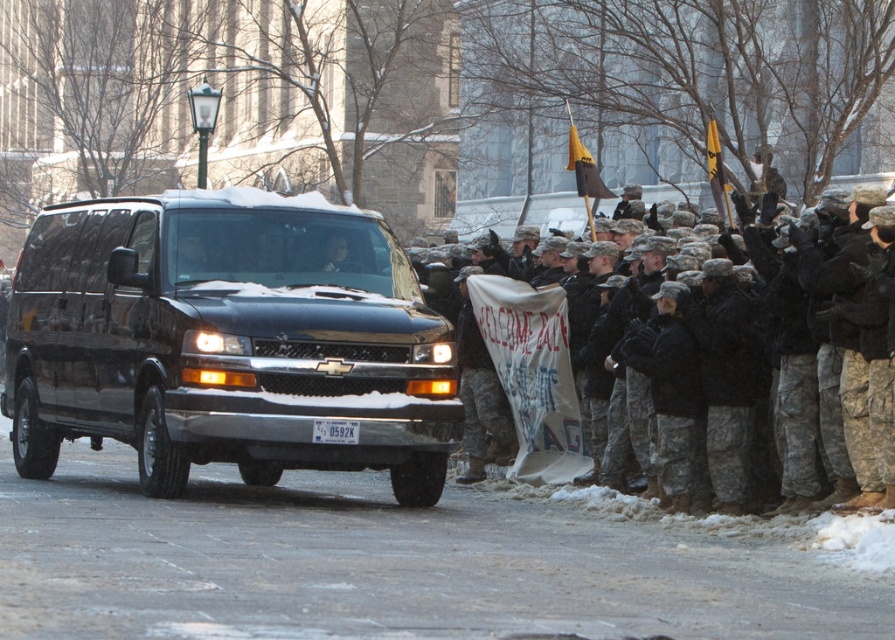
Locate an element on the screen. black matte van at center is located at coordinates (227, 340).

Does point (248, 390) come in front of point (846, 196)?

Yes, it is in front of point (846, 196).

Is point (169, 429) farther from viewer compared to point (842, 193)?

No, it is not.

At what (x,y) coordinates should I click in order to perform the action: click on black matte van at center. Please return your answer as a coordinate pair (x, y). This screenshot has height=640, width=895. Looking at the image, I should click on (227, 340).

Does camouflage fabric uniform at right have a lesser height compared to white plastic license plate at center?

No.

You are a GUI agent. You are given a task and a screenshot of the screen. Output one action in this format:
    pyautogui.click(x=<x>, y=<y>)
    Task: Click on the camouflage fabric uniform at right
    
    Given the screenshot: What is the action you would take?
    pyautogui.click(x=782, y=339)

Which is in front, point (814, 397) or point (344, 428)?

Point (344, 428) is more forward.

You are a GUI agent. You are given a task and a screenshot of the screen. Output one action in this format:
    pyautogui.click(x=<x>, y=<y>)
    Task: Click on the camouflage fabric uniform at right
    
    Given the screenshot: What is the action you would take?
    pyautogui.click(x=782, y=339)

Does black matte van at center have a greater height compared to white plastic license plate at center?

Yes.

Which is more to the right, black matte van at center or white plastic license plate at center?

From the viewer's perspective, white plastic license plate at center appears more on the right side.

At what (x,y) coordinates should I click in order to perform the action: click on black matte van at center. Please return your answer as a coordinate pair (x, y). The height and width of the screenshot is (640, 895). Looking at the image, I should click on (227, 340).